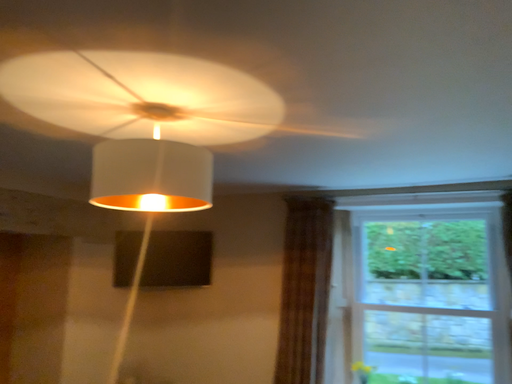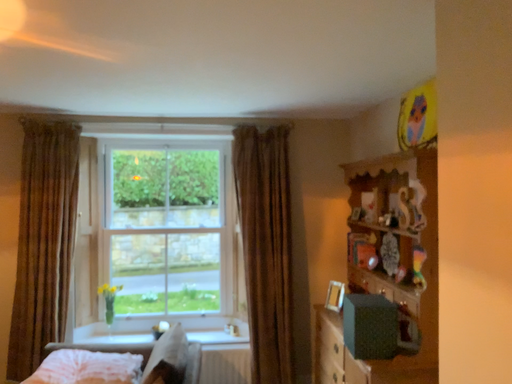
Question: Which way did the camera rotate in the video?

Choices:
 (A) rotated left
 (B) rotated right

Answer: (B)